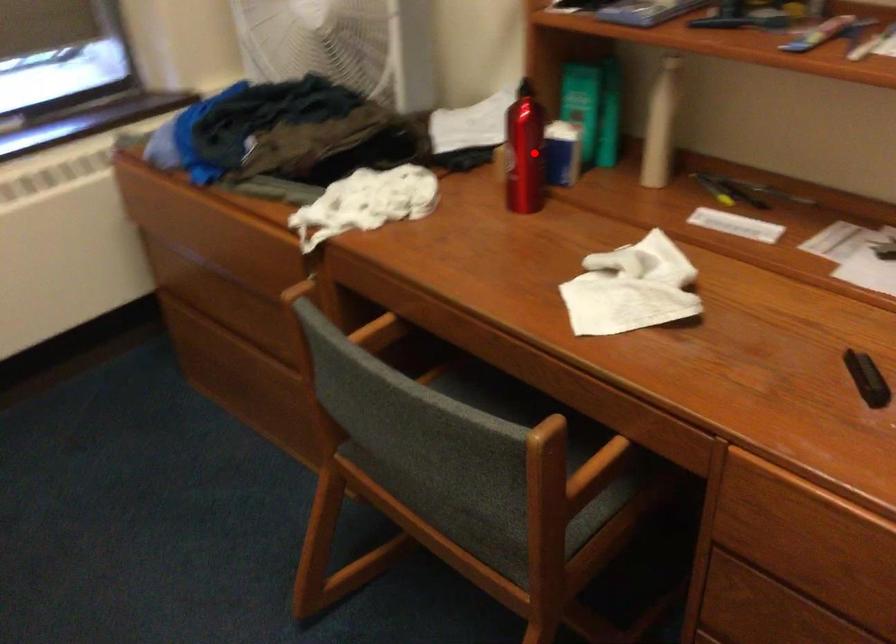
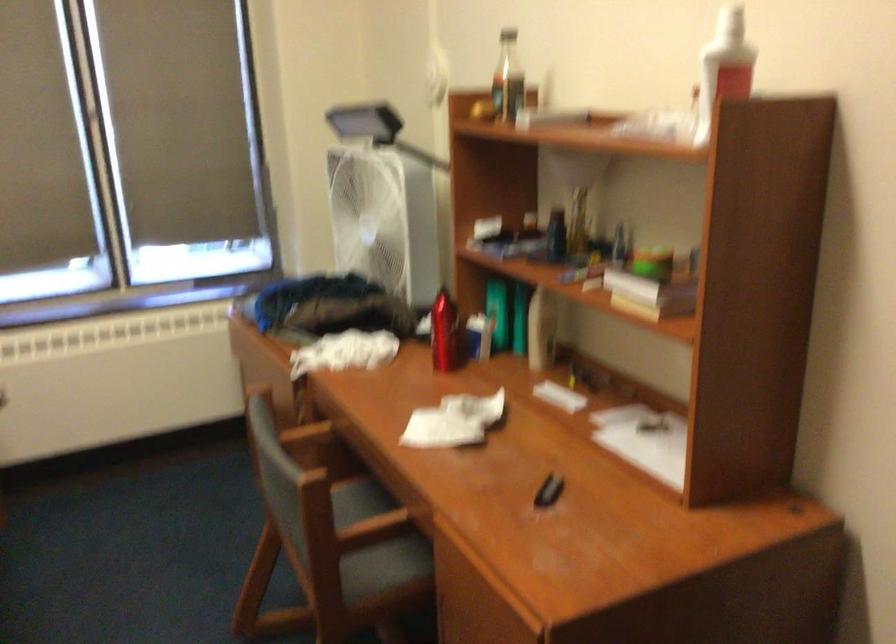
Locate, in the second image, the point that corresponds to the highlighted location in the first image.

(444, 333)